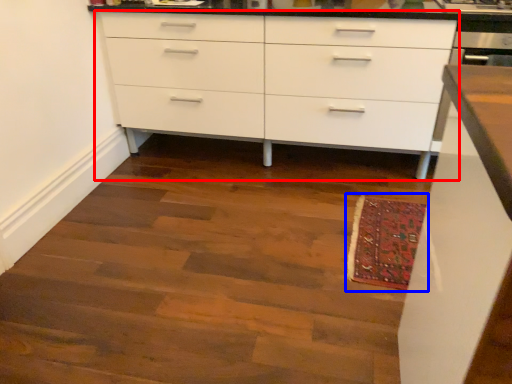
Question: Among these objects, which one is farthest to the camera, chest of drawers (highlighted by a red box) or mat (highlighted by a blue box)?

Choices:
 (A) chest of drawers
 (B) mat

Answer: (A)